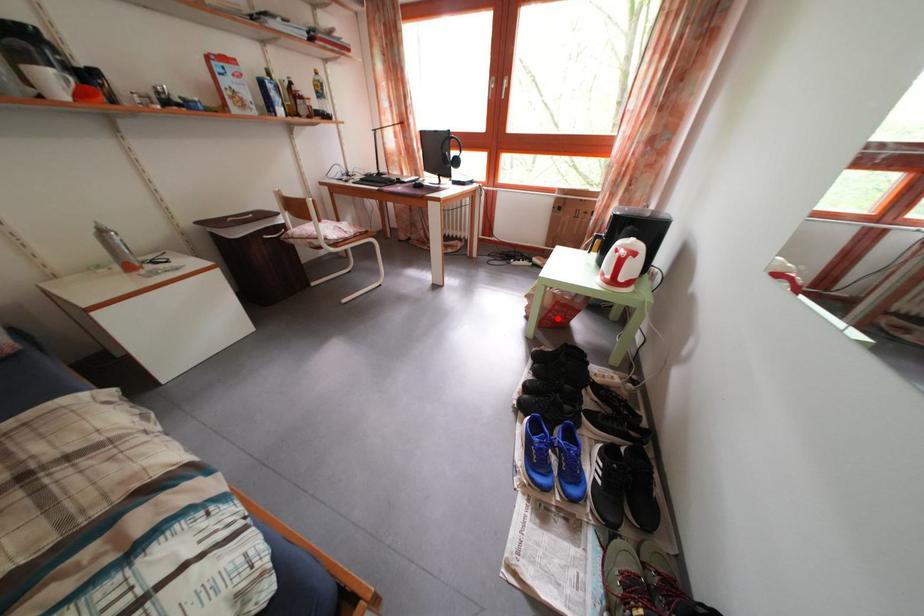
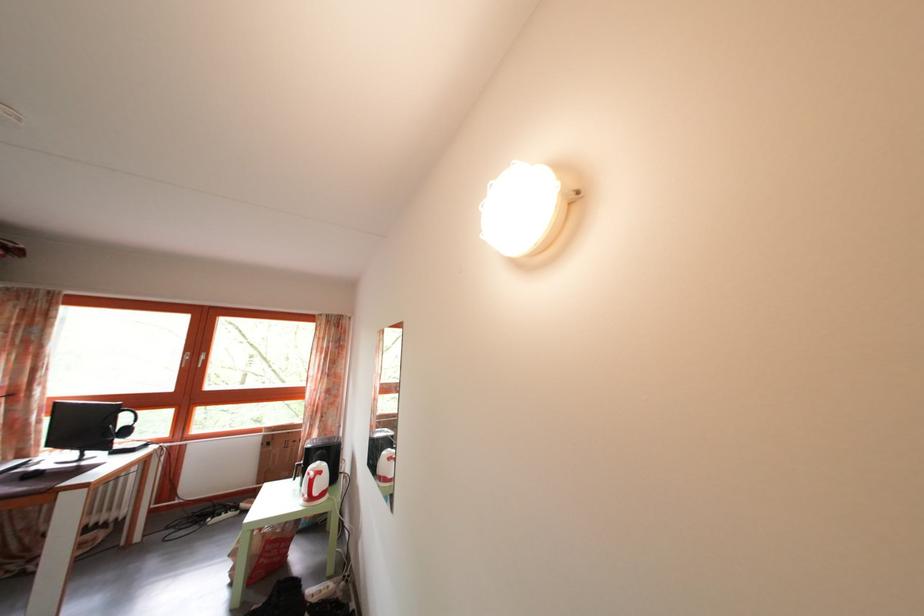
Question: I am providing you with two images of the same scene from different viewpoints. Given a red point in image1, look at the same physical point in image2. Is it:

Choices:
 (A) Closer to the viewpoint
 (B) Farther from the viewpoint

Answer: (B)